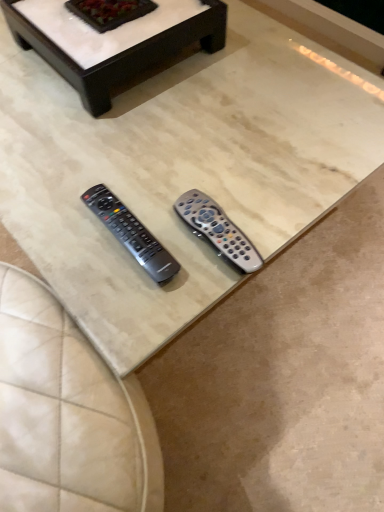
The height and width of the screenshot is (512, 384). I want to click on free point in front of silver metallic remote at center, which is counted as the first remote control, starting from the left, so click(126, 302).